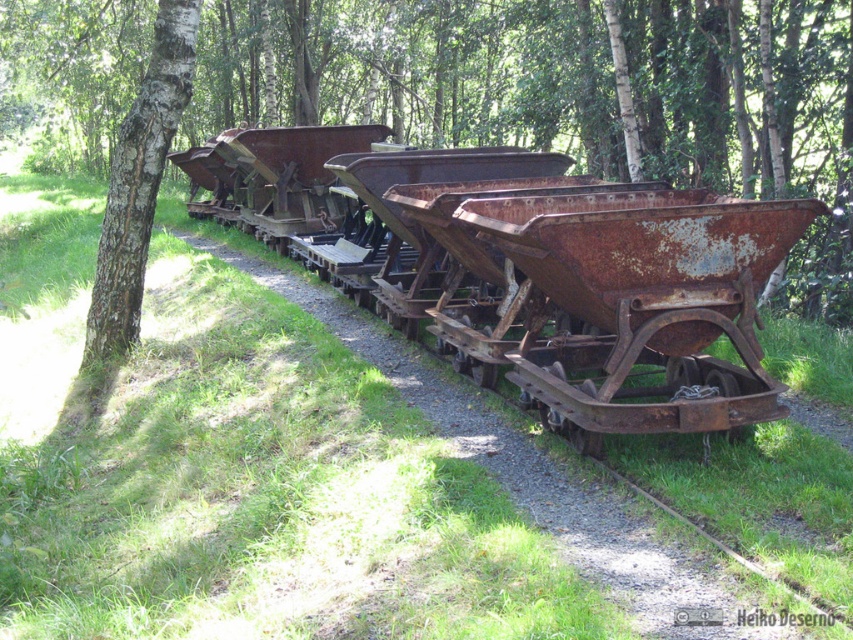
You are a hiker who wants to take a photo of the white bark tree at left and the rusty metal wagon at center. Which object should you stand closer to in order to capture both in a single frame without moving your camera position?

You should stand closer to the white bark tree at left because the rusty metal wagon at center is to the right of it, allowing both to be included in the frame when positioned near the tree.

You are a park ranger assessing the area for safety. You notice the rusty metal wagon at center and the white bark tree at left. Which object is wider?

The rusty metal wagon at center is wider than the white bark tree at left.

You are standing at the origin point of the image coordinate system. You want to walk to the rusty metal wagon at center. What are the coordinates you need to move to?

The coordinates you need to move to are approximately 0.431 in the x direction and 0.676 in the y direction.